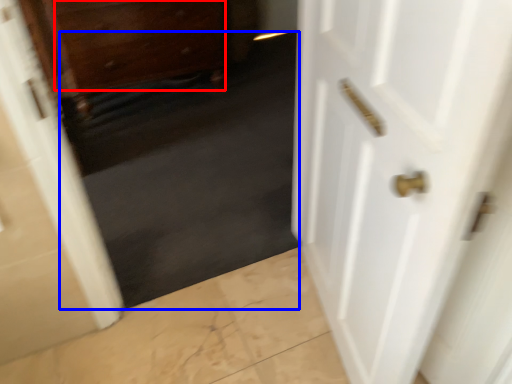
Question: Which object is further to the camera taking this photo, drawer (highlighted by a red box) or dark (highlighted by a blue box)?

Choices:
 (A) drawer
 (B) dark

Answer: (A)